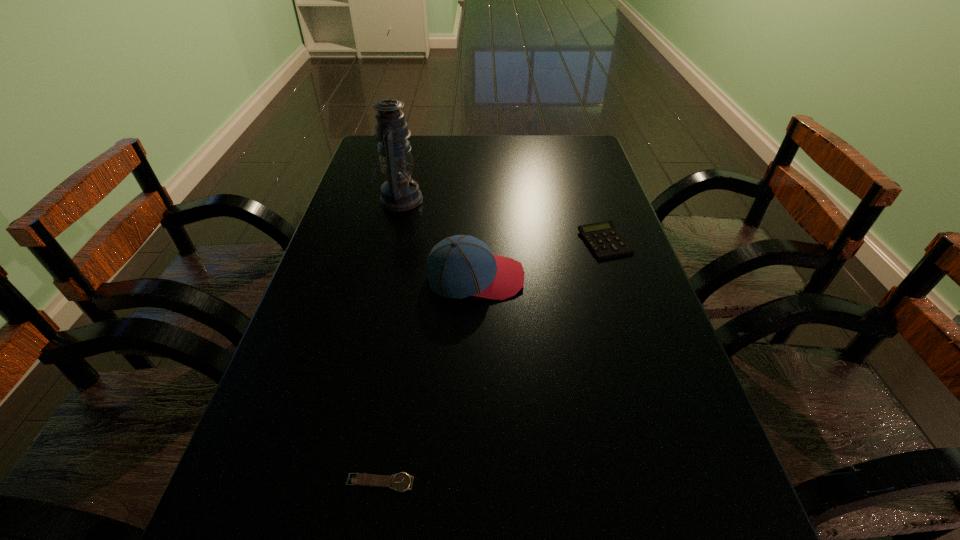
Locate an element on the screen. lantern is located at coordinates (399, 192).

Identify the location of the tallest object. (399, 192).

Locate an element on the screen. This screenshot has height=540, width=960. the second tallest object is located at coordinates (459, 266).

Find the location of a particular element. the rightmost object is located at coordinates (604, 240).

Locate an element on the screen. calculator is located at coordinates (604, 240).

The height and width of the screenshot is (540, 960). In order to click on the shortest object in this screenshot , I will do `click(401, 482)`.

The width and height of the screenshot is (960, 540). I want to click on the nearest object, so click(x=401, y=482).

Image resolution: width=960 pixels, height=540 pixels. Identify the location of blank space located on the front-facing side of the farthest object. (475, 199).

Where is `free space located on the front-facing side of the baseball cap`? The image size is (960, 540). free space located on the front-facing side of the baseball cap is located at coordinates point(614,278).

The width and height of the screenshot is (960, 540). I want to click on free spot located 0.250m on the left of the second shortest object, so click(482, 242).